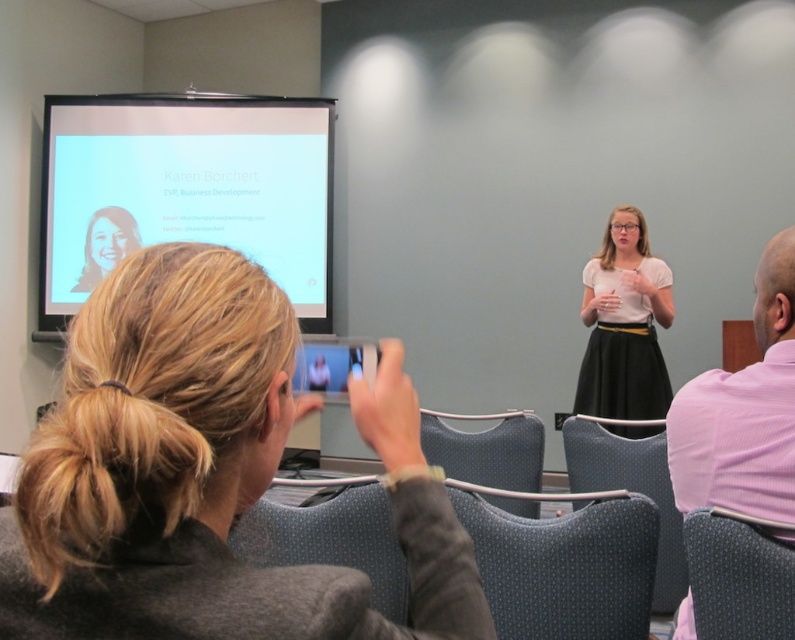
Question: Which object appears farthest from the camera in this image?

Choices:
 (A) pink textured shirt at right
 (B) blonde hair at upper left
 (C) matte black portrait at upper left
 (D) dark blue textured fabric chair at center

Answer: (C)

Question: Which point is closer to the camera taking this photo?

Choices:
 (A) (530, 500)
 (B) (681, 592)
 (C) (708, 522)

Answer: (C)

Question: Estimate the real-world distances between objects in this image. Which object is closer to the white matte projection screen at upper left?

Choices:
 (A) velvet-like dark gray chair at lower right
 (B) dark gray fabric chair at center

Answer: (B)

Question: Can you confirm if dark gray fabric chair at center is positioned to the left of matte black portrait at upper left?

Choices:
 (A) yes
 (B) no

Answer: (B)

Question: Is dark blue textured fabric chair at center further to the viewer compared to dark gray fabric chair at center?

Choices:
 (A) yes
 (B) no

Answer: (B)

Question: Can you confirm if dark gray fabric chair at lower right is positioned to the right of matte black portrait at upper left?

Choices:
 (A) yes
 (B) no

Answer: (A)